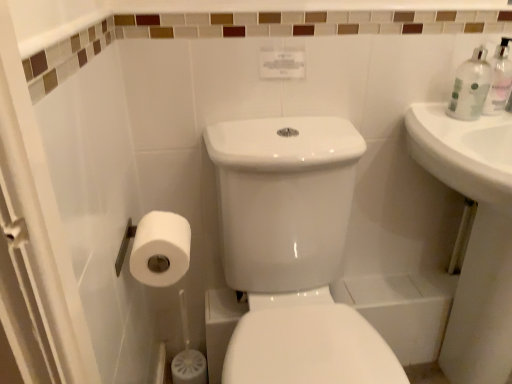
This screenshot has height=384, width=512. Identify the location of blank area to the left of clear plastic bottle at upper right. (461, 118).